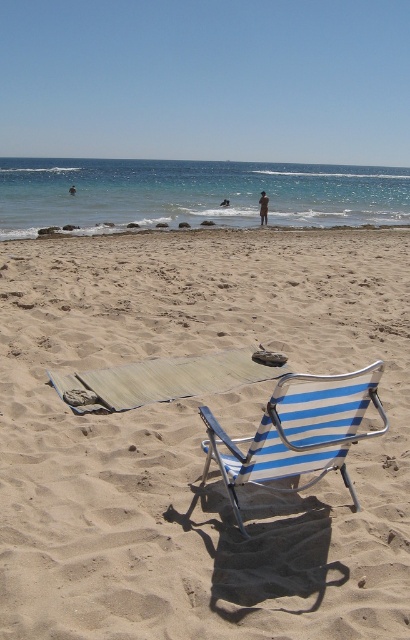
You are standing on the beach and see the blue striped fabric beach chair at center and the skinny man at center. Which object is closer to the ocean?

The blue striped fabric beach chair at center is closer to the ocean because it is located below the skinny man at center, meaning it is positioned lower on the beach slope towards the water.

You are standing on the beach and want to place a small bucket on the ground. Which area would you choose between the beige sand at center and the smooth sand at lower center if you want the bucket to be more elevated?

The beige sand at center has a greater height compared to smooth sand at lower center, so placing the bucket there would make it more elevated.